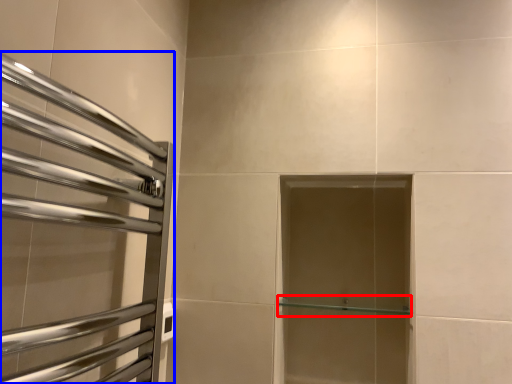
Question: Which of the following is the farthest to the observer, shelf (highlighted by a red box) or screen door (highlighted by a blue box)?

Choices:
 (A) shelf
 (B) screen door

Answer: (A)